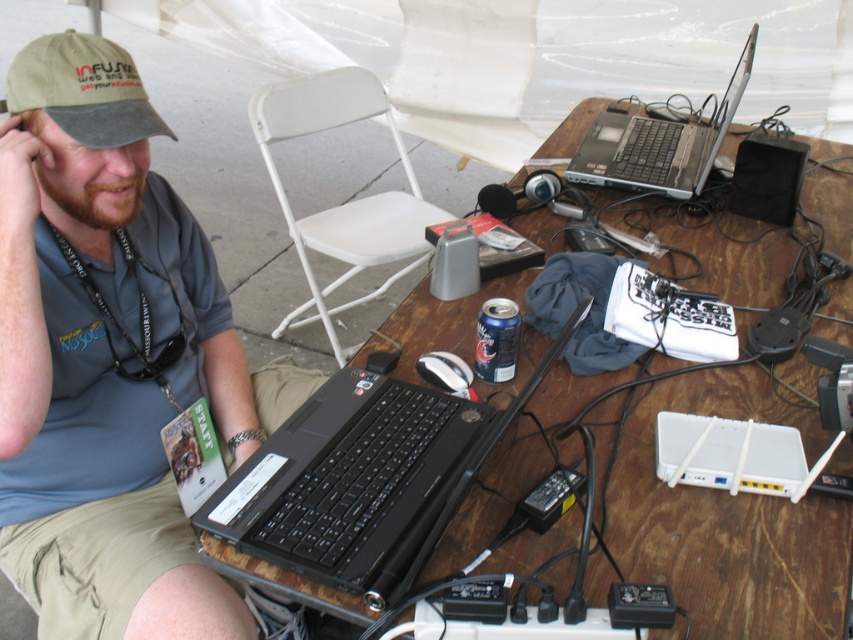
Is black plastic laptop at center above white plastic chair at center?

Incorrect, black plastic laptop at center is not positioned above white plastic chair at center.

Consider the image. Is the position of black plastic laptop at center less distant than that of white plastic chair at center?

A: Yes, it is in front of white plastic chair at center.

Is point (277, 458) positioned before point (335, 307)?

Yes, point (277, 458) is closer to viewer.

Image resolution: width=853 pixels, height=640 pixels. I want to click on black plastic laptop at center, so click(x=364, y=477).

Who is shorter, wooden table at center or white plastic chair at center?

With less height is white plastic chair at center.

Does wooden table at center have a lesser width compared to white plastic chair at center?

No.

Does point (256, 561) come closer to viewer compared to point (338, 228)?

That is True.

At what (x,y) coordinates should I click in order to perform the action: click on wooden table at center. Please return your answer as a coordinate pair (x, y). Image resolution: width=853 pixels, height=640 pixels. Looking at the image, I should click on (730, 522).

Which of these two, matte black laptop at left or white plastic chair at center, stands shorter?

matte black laptop at left is shorter.

At what (x,y) coordinates should I click in order to perform the action: click on matte black laptop at left. Please return your answer as a coordinate pair (x, y). This screenshot has height=640, width=853. Looking at the image, I should click on coord(109,356).